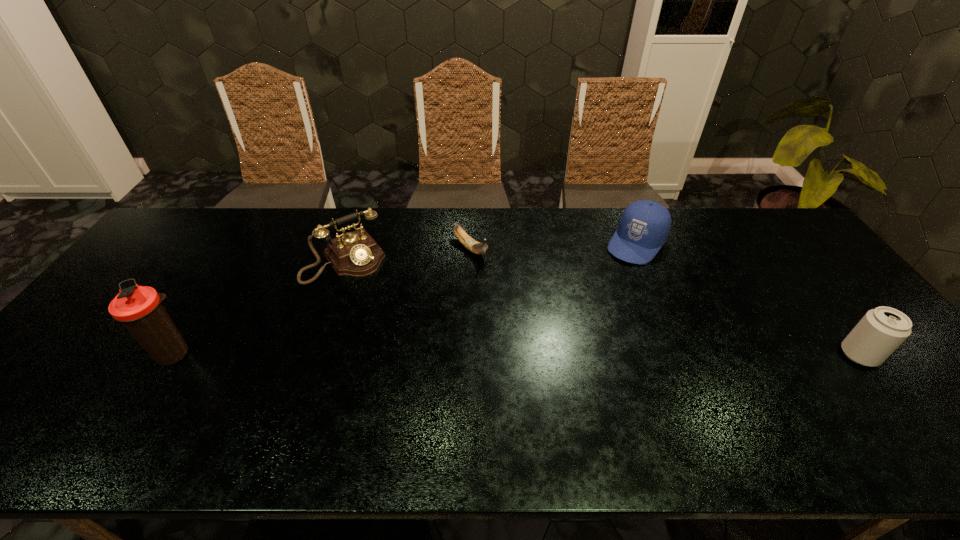
I want to click on free space between the telephone and the third object from left to right, so click(x=408, y=254).

Locate an element on the screen. empty space that is in between the shortest object and the fourth object from left to right is located at coordinates (553, 246).

This screenshot has width=960, height=540. I want to click on free spot between the cap and the telephone, so click(x=491, y=252).

Where is `empty location between the can and the telephone`? This screenshot has width=960, height=540. empty location between the can and the telephone is located at coordinates (602, 307).

At what (x,y) coordinates should I click in order to perform the action: click on vacant space that's between the tallest object and the fourth object from right to left. Please return your answer as a coordinate pair (x, y). The height and width of the screenshot is (540, 960). Looking at the image, I should click on (259, 307).

Find the location of a particular element. The image size is (960, 540). vacant point located between the third object from left to right and the can is located at coordinates (665, 302).

This screenshot has height=540, width=960. Identify the location of unoccupied position between the fourth object from right to left and the thermos bottle. (259, 307).

This screenshot has width=960, height=540. Identify the location of blank region between the tallest object and the banana. (323, 302).

Locate which object is the second closest to the banana. Please provide its 2D coordinates. Your answer should be formatted as a tuple, i.e. [(x, y)], where the tuple contains the x and y coordinates of a point satisfying the conditions above.

[(644, 226)]

Identify the location of object identified as the second closest to the fourth object from left to right. The image size is (960, 540). (882, 330).